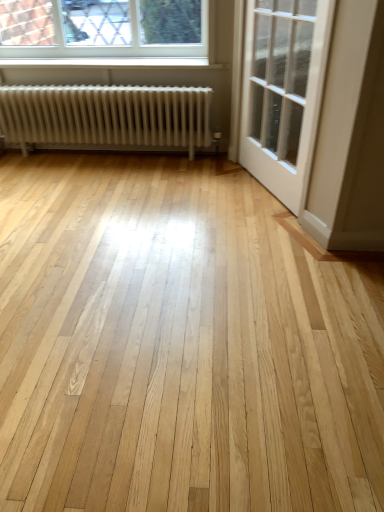
Question: Is clear glass window at upper left thinner than white glossy door at upper right?

Choices:
 (A) no
 (B) yes

Answer: (B)

Question: Considering the relative positions of clear glass window at upper left and white glossy door at upper right in the image provided, is clear glass window at upper left to the right of white glossy door at upper right from the viewer's perspective?

Choices:
 (A) yes
 (B) no

Answer: (B)

Question: Would you say clear glass window at upper left contains white glossy door at upper right?

Choices:
 (A) no
 (B) yes

Answer: (A)

Question: Is the depth of clear glass window at upper left greater than that of white glossy door at upper right?

Choices:
 (A) no
 (B) yes

Answer: (B)

Question: Considering the relative sizes of clear glass window at upper left and white glossy door at upper right in the image provided, is clear glass window at upper left bigger than white glossy door at upper right?

Choices:
 (A) no
 (B) yes

Answer: (A)

Question: From the image's perspective, is white glossy door at upper right located above or below white matte radiator at left?

Choices:
 (A) below
 (B) above

Answer: (A)

Question: Considering the positions of white glossy door at upper right and white matte radiator at left in the image, is white glossy door at upper right taller or shorter than white matte radiator at left?

Choices:
 (A) tall
 (B) short

Answer: (A)

Question: Is white glossy door at upper right wider or thinner than white matte radiator at left?

Choices:
 (A) thin
 (B) wide

Answer: (A)

Question: In the image, is white glossy door at upper right on the left side or the right side of white matte radiator at left?

Choices:
 (A) right
 (B) left

Answer: (A)

Question: From a real-world perspective, relative to clear glass window at upper left, is white glossy door at upper right vertically above or below?

Choices:
 (A) above
 (B) below

Answer: (B)

Question: Is white glossy door at upper right bigger or smaller than clear glass window at upper left?

Choices:
 (A) big
 (B) small

Answer: (A)

Question: From their relative heights in the image, would you say white glossy door at upper right is taller or shorter than clear glass window at upper left?

Choices:
 (A) tall
 (B) short

Answer: (A)

Question: In the image, is white glossy door at upper right on the left side or the right side of clear glass window at upper left?

Choices:
 (A) right
 (B) left

Answer: (A)

Question: Would you say white matte radiator at left is inside or outside white glossy door at upper right?

Choices:
 (A) outside
 (B) inside

Answer: (A)

Question: Is white matte radiator at left bigger or smaller than white glossy door at upper right?

Choices:
 (A) small
 (B) big

Answer: (B)